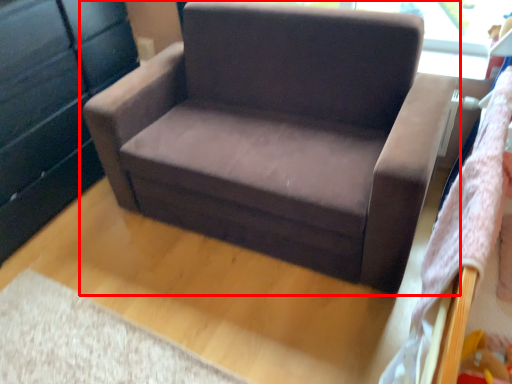
Question: From the image's perspective, what is the correct spatial positioning of chair (annotated by the red box) in reference to dresser?

Choices:
 (A) below
 (B) above

Answer: (A)